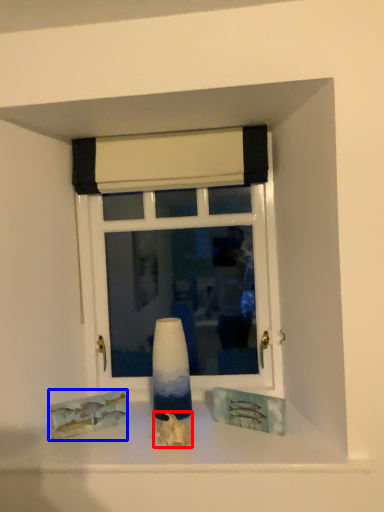
Question: Which point is further to the camera, art (highlighted by a red box) or art (highlighted by a blue box)?

Choices:
 (A) art
 (B) art

Answer: (B)